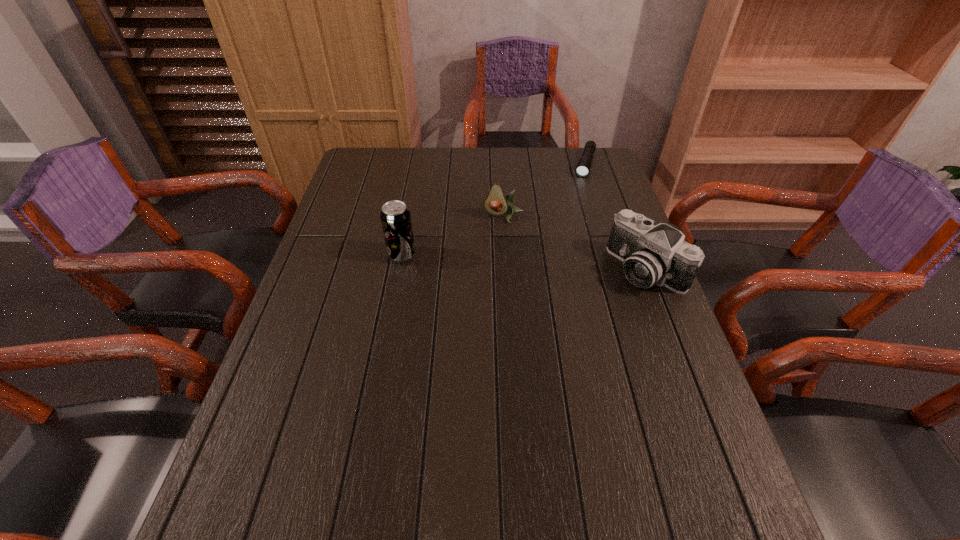
Identify the location of vacant space located 0.130m at the lens end of the flashlight. The image size is (960, 540). (578, 199).

This screenshot has height=540, width=960. Find the location of `vacant space located 0.200m on the seed side of the avocado`. vacant space located 0.200m on the seed side of the avocado is located at coordinates point(489,268).

Find the location of a particular element. The image size is (960, 540). blank space located on the seed side of the avocado is located at coordinates (488, 273).

Where is `vacant space located on the seed side of the avocado`? Image resolution: width=960 pixels, height=540 pixels. vacant space located on the seed side of the avocado is located at coordinates (476, 318).

You are a GUI agent. You are given a task and a screenshot of the screen. Output one action in this format:
    pyautogui.click(x=<x>, y=<y>)
    Task: Click on the object that is positioned at the far edge
    
    Given the screenshot: What is the action you would take?
    pyautogui.click(x=583, y=167)

Identify the location of camera at the right edge. (651, 254).

At what (x,y) coordinates should I click in order to perform the action: click on flashlight positioned at the right edge. Please return your answer as a coordinate pair (x, y). Looking at the image, I should click on (583, 167).

Find the location of a particular element. The image size is (960, 540). object that is at the far right corner is located at coordinates (583, 167).

This screenshot has height=540, width=960. I want to click on vacant space at the far edge, so click(x=487, y=158).

Locate an element on the screen. The image size is (960, 540). free space at the left edge of the desktop is located at coordinates (335, 315).